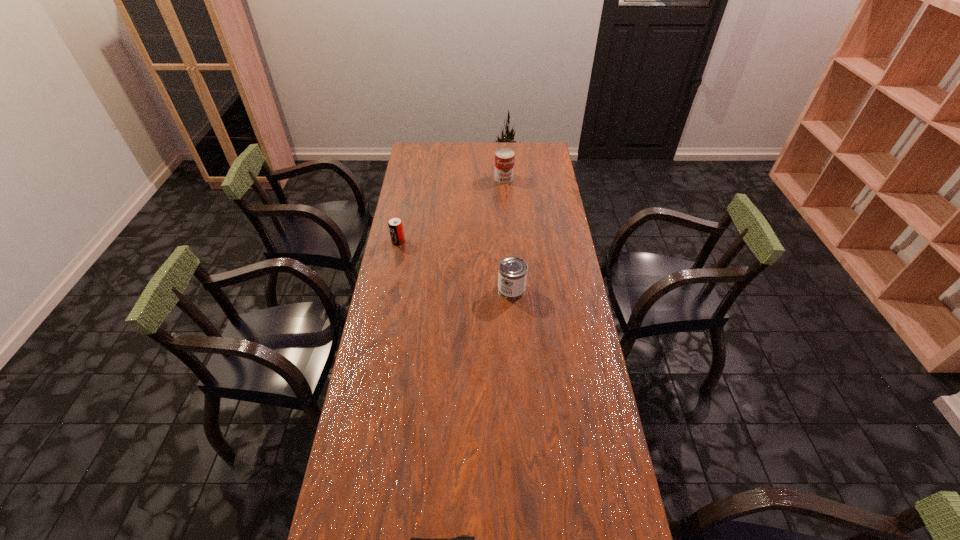
This screenshot has height=540, width=960. In the image, there is a desktop. What are the coordinates of `free space at the right edge` in the screenshot? It's located at (565, 502).

In the image, there is a desktop. What are the coordinates of `free space at the far left corner` in the screenshot? It's located at (417, 145).

This screenshot has height=540, width=960. In order to click on vacant space at the far right corner in this screenshot , I will do `click(544, 147)`.

Locate an element on the screen. vacant area that lies between the third nearest object and the farthest can is located at coordinates (451, 210).

Identify the location of free point between the farthest can and the second nearest can. The image size is (960, 540). (451, 210).

At what (x,y) coordinates should I click in order to perform the action: click on free spot between the farthest can and the second nearest object. Please return your answer as a coordinate pair (x, y). This screenshot has width=960, height=540. Looking at the image, I should click on (508, 234).

Image resolution: width=960 pixels, height=540 pixels. I want to click on empty space that is in between the farthest object and the leftmost can, so click(x=451, y=210).

Where is `vacant space in between the second farthest can and the nearest can`? The width and height of the screenshot is (960, 540). vacant space in between the second farthest can and the nearest can is located at coordinates (455, 265).

Select which object appears as the closest to the farthest can. Please provide its 2D coordinates. Your answer should be formatted as a tuple, i.e. [(x, y)], where the tuple contains the x and y coordinates of a point satisfying the conditions above.

[(395, 225)]

Identify which object is located as the nearest to the farthest object. Please provide its 2D coordinates. Your answer should be formatted as a tuple, i.e. [(x, y)], where the tuple contains the x and y coordinates of a point satisfying the conditions above.

[(395, 225)]